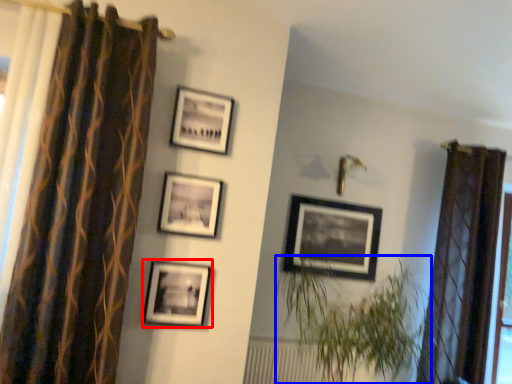
Question: Among these objects, which one is farthest to the camera, picture frame (highlighted by a red box) or houseplant (highlighted by a blue box)?

Choices:
 (A) picture frame
 (B) houseplant

Answer: (A)